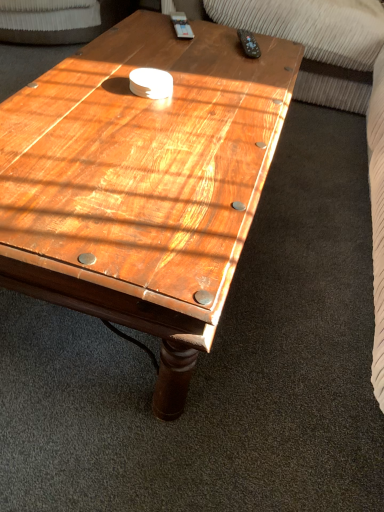
Describe the element at coordinates (248, 44) in the screenshot. I see `black plastic remote at upper right` at that location.

Identify the location of black plastic remote at upper right. (248, 44).

Describe the element at coordinates (142, 181) in the screenshot. I see `wooden coffee table at center` at that location.

What are the coordinates of `wooden coffee table at center` in the screenshot? It's located at (142, 181).

Identify the location of black plastic remote at upper right. This screenshot has width=384, height=512. (248, 44).

Can you confirm if wooden coffee table at center is positioned to the right of black plastic remote at upper right?

In fact, wooden coffee table at center is to the left of black plastic remote at upper right.

Is wooden coffee table at center in front of or behind black plastic remote at upper right in the image?

Clearly, wooden coffee table at center is in front of black plastic remote at upper right.

Considering the points (47, 103) and (240, 35), which point is behind, point (47, 103) or point (240, 35)?

The point (240, 35) is farther from the camera.

From the image's perspective, relative to black plastic remote at upper right, is wooden coffee table at center above or below?

Result: wooden coffee table at center is below black plastic remote at upper right.

From a real-world perspective, which is physically above, wooden coffee table at center or black plastic remote at upper right?

In real-world perspective, black plastic remote at upper right is above.

Can you confirm if wooden coffee table at center is wider than black plastic remote at upper right?

Yes.

Which of these two, wooden coffee table at center or black plastic remote at upper right, stands shorter?

black plastic remote at upper right is shorter.

Can you confirm if wooden coffee table at center is smaller than black plastic remote at upper right?

No, wooden coffee table at center is not smaller than black plastic remote at upper right.

Would you say wooden coffee table at center is outside black plastic remote at upper right?

Yes, wooden coffee table at center is not within black plastic remote at upper right.

Is wooden coffee table at center far from black plastic remote at upper right?

wooden coffee table at center is actually quite close to black plastic remote at upper right.

Is wooden coffee table at center oriented towards black plastic remote at upper right?

No, wooden coffee table at center is not oriented towards black plastic remote at upper right.

Where is `remote above the wooden coffee table at center (from the image's perspective)`? This screenshot has height=512, width=384. remote above the wooden coffee table at center (from the image's perspective) is located at coordinates (248, 44).

Is black plastic remote at upper right to the left or to the right of wooden coffee table at center in the image?

Clearly, black plastic remote at upper right is on the right of wooden coffee table at center in the image.

Is the position of black plastic remote at upper right more distant than that of wooden coffee table at center?

Yes, black plastic remote at upper right is further from the viewer.

Considering the positions of points (247, 37) and (223, 98), is point (247, 37) farther from camera compared to point (223, 98)?

Yes, point (247, 37) is behind point (223, 98).

From the image's perspective, is black plastic remote at upper right on wooden coffee table at center?

Yes, from the image's perspective, black plastic remote at upper right is over wooden coffee table at center.

From a real-world perspective, is black plastic remote at upper right located beneath wooden coffee table at center?

No, from a real-world perspective, black plastic remote at upper right is not under wooden coffee table at center.

Which of these two, black plastic remote at upper right or wooden coffee table at center, is thinner?

black plastic remote at upper right.

In terms of height, does black plastic remote at upper right look taller or shorter compared to wooden coffee table at center?

Considering their sizes, black plastic remote at upper right has less height than wooden coffee table at center.

Which of these two, black plastic remote at upper right or wooden coffee table at center, is smaller?

black plastic remote at upper right is smaller.

Is black plastic remote at upper right situated inside wooden coffee table at center or outside?

black plastic remote at upper right is inside wooden coffee table at center.

Is black plastic remote at upper right in contact with wooden coffee table at center?

No, black plastic remote at upper right is not in contact with wooden coffee table at center.

Is wooden coffee table at center at the back of black plastic remote at upper right?

black plastic remote at upper right is not turned away from wooden coffee table at center.

You are a GUI agent. You are given a task and a screenshot of the screen. Output one action in this format:
    pyautogui.click(x=<x>, y=<y>)
    Task: Click on the remote behind the wooden coffee table at center
    The height and width of the screenshot is (512, 384).
    Given the screenshot: What is the action you would take?
    pyautogui.click(x=248, y=44)

Find the location of a particular element. remote behind the wooden coffee table at center is located at coordinates (248, 44).

Where is `remote that is above the wooden coffee table at center (from a real-world perspective)`? The image size is (384, 512). remote that is above the wooden coffee table at center (from a real-world perspective) is located at coordinates (248, 44).